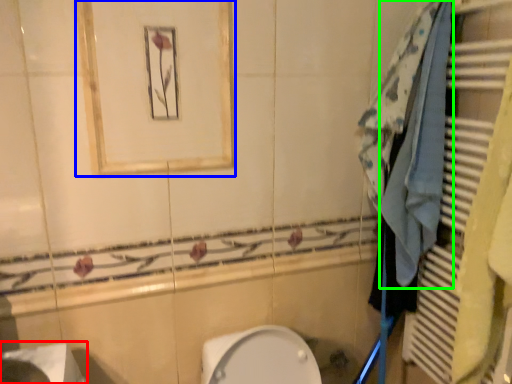
Question: Which object is the farthest from sink (highlighted by a red box)? Choose among these: medicine cabinet (highlighted by a blue box) or bath towel (highlighted by a green box).

Choices:
 (A) medicine cabinet
 (B) bath towel

Answer: (B)